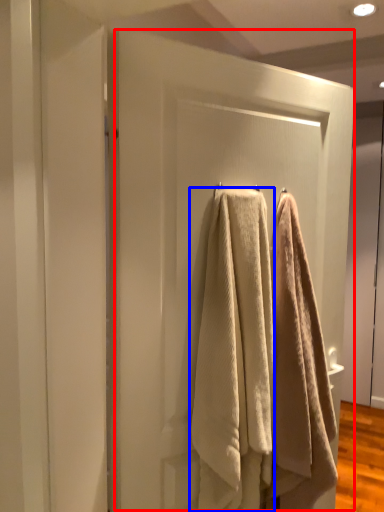
Question: Which object appears closest to the camera in this image, screen door (highlighted by a red box) or towel (highlighted by a blue box)?

Choices:
 (A) screen door
 (B) towel

Answer: (A)